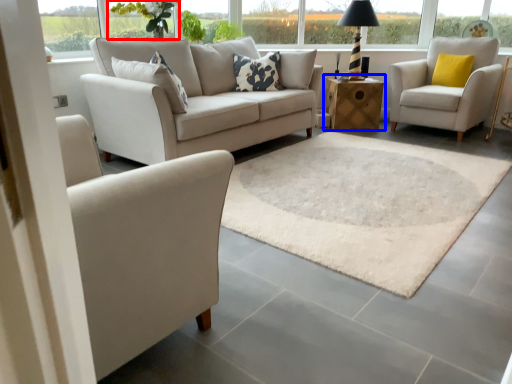
Question: Which point is closer to the camera, flower (highlighted by a red box) or table (highlighted by a blue box)?

Choices:
 (A) flower
 (B) table

Answer: (A)